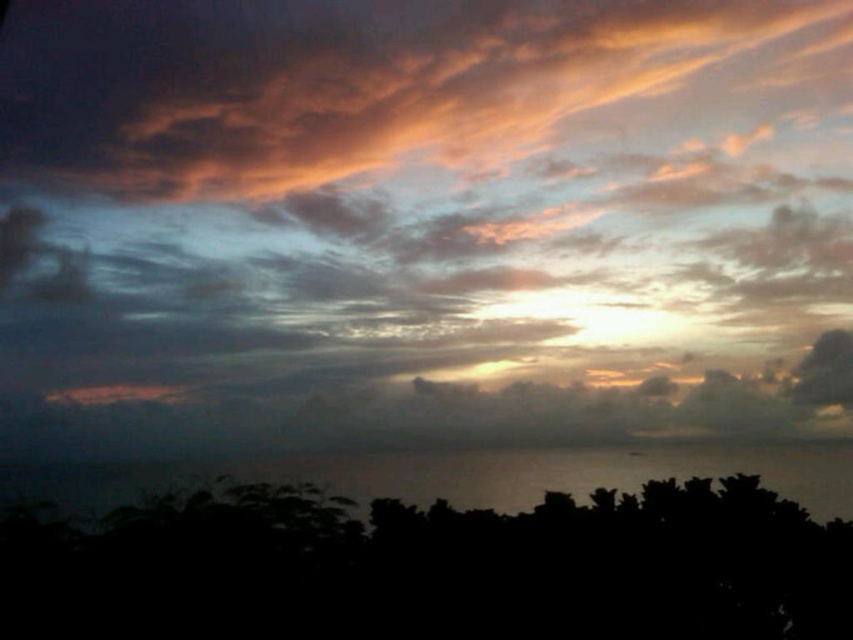
You are standing at the point closer to the viewer in this sunset scene. Which point are you at, point (500, 436) or point (173, 604)?

You are at point (500, 436) because it is further to the viewer than point (173, 604).

You are standing on a beach and looking at the cloudy sky at upper center and the black matte tree at lower center. Which object appears closer to you?

The cloudy sky at upper center appears closer to you because it is further to the viewer than the black matte tree at lower center.

You are a drone operator trying to capture the sunset. Your drone is currently at point 0.347, 0.496. Can you confirm if the cloudy sky at upper center is directly above your current position?

The cloudy sky at upper center is located at point (422, 221), so yes, it is directly above your current position.